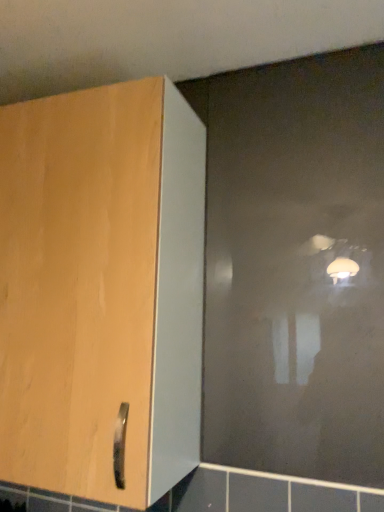
Question: Does transparent matte glass door at upper right appear on the right side of matte wood cupboard at left?

Choices:
 (A) no
 (B) yes

Answer: (B)

Question: Is transparent matte glass door at upper right further to camera compared to matte wood cupboard at left?

Choices:
 (A) no
 (B) yes

Answer: (B)

Question: Considering the relative sizes of transparent matte glass door at upper right and matte wood cupboard at left in the image provided, is transparent matte glass door at upper right shorter than matte wood cupboard at left?

Choices:
 (A) no
 (B) yes

Answer: (A)

Question: Is transparent matte glass door at upper right aimed at matte wood cupboard at left?

Choices:
 (A) yes
 (B) no

Answer: (B)

Question: From the image's perspective, is transparent matte glass door at upper right located above matte wood cupboard at left?

Choices:
 (A) no
 (B) yes

Answer: (B)

Question: Does transparent matte glass door at upper right have a lesser width compared to matte wood cupboard at left?

Choices:
 (A) yes
 (B) no

Answer: (A)

Question: Is transparent matte glass door at upper right to the left of matte ceramic tile at lower left from the viewer's perspective?

Choices:
 (A) no
 (B) yes

Answer: (A)

Question: Is transparent matte glass door at upper right facing away from matte ceramic tile at lower left?

Choices:
 (A) no
 (B) yes

Answer: (A)

Question: Considering the relative sizes of transparent matte glass door at upper right and matte ceramic tile at lower left in the image provided, is transparent matte glass door at upper right shorter than matte ceramic tile at lower left?

Choices:
 (A) no
 (B) yes

Answer: (A)

Question: Is transparent matte glass door at upper right closer to the viewer compared to matte ceramic tile at lower left?

Choices:
 (A) yes
 (B) no

Answer: (A)

Question: Can you confirm if transparent matte glass door at upper right is smaller than matte ceramic tile at lower left?

Choices:
 (A) no
 (B) yes

Answer: (A)

Question: Is transparent matte glass door at upper right touching matte ceramic tile at lower left?

Choices:
 (A) no
 (B) yes

Answer: (A)

Question: Is transparent matte glass door at upper right located within matte ceramic tile at lower left?

Choices:
 (A) no
 (B) yes

Answer: (A)